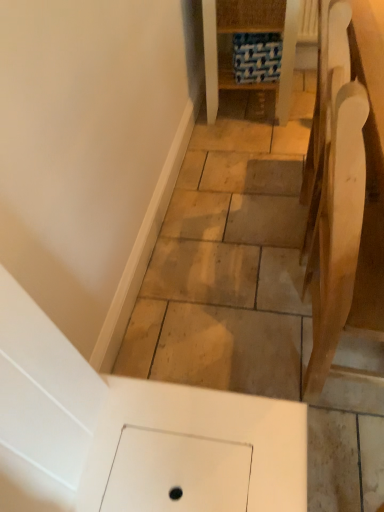
Question: In the image, is blue fabric at center, which appears as the second furniture when viewed from the front, on the left side or the right side of light brown wood chair at right, the second furniture positioned from the back?

Choices:
 (A) right
 (B) left

Answer: (B)

Question: Is blue fabric at center, which is the first furniture in back-to-front order, wider or thinner than light brown wood chair at right, which is the 1th furniture from front to back?

Choices:
 (A) wide
 (B) thin

Answer: (A)

Question: Is blue fabric at center, which appears as the second furniture when viewed from the front, spatially inside light brown wood chair at right, marked as the 2th furniture in a top-to-bottom arrangement, or outside of it?

Choices:
 (A) outside
 (B) inside

Answer: (A)

Question: Is light brown wood chair at right, which is the 1th furniture from front to back, taller or shorter than blue fabric at center, which appears as the second furniture when viewed from the front?

Choices:
 (A) short
 (B) tall

Answer: (B)

Question: Considering the positions of point (314, 260) and point (205, 7), is point (314, 260) closer or farther from the camera than point (205, 7)?

Choices:
 (A) closer
 (B) farther

Answer: (A)

Question: From a real-world perspective, is light brown wood chair at right, acting as the 1th furniture starting from the bottom, above or below blue fabric at center, marked as the 1th furniture in a top-to-bottom arrangement?

Choices:
 (A) above
 (B) below

Answer: (A)

Question: Considering the positions of light brown wood chair at right, acting as the 1th furniture starting from the bottom, and blue fabric at center, which appears as the second furniture when viewed from the front, in the image, is light brown wood chair at right, acting as the 1th furniture starting from the bottom, wider or thinner than blue fabric at center, which appears as the second furniture when viewed from the front,?

Choices:
 (A) thin
 (B) wide

Answer: (A)